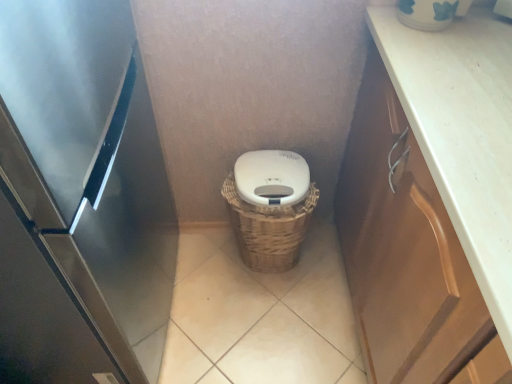
Find the location of a particular element. The image size is (512, 384). free space below woven brown basket at center (from a real-world perspective) is located at coordinates (269, 267).